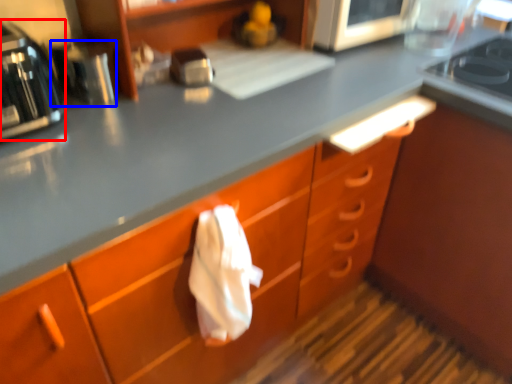
Question: Which point is further to the camera, home appliance (highlighted by a red box) or appliance (highlighted by a blue box)?

Choices:
 (A) home appliance
 (B) appliance

Answer: (B)